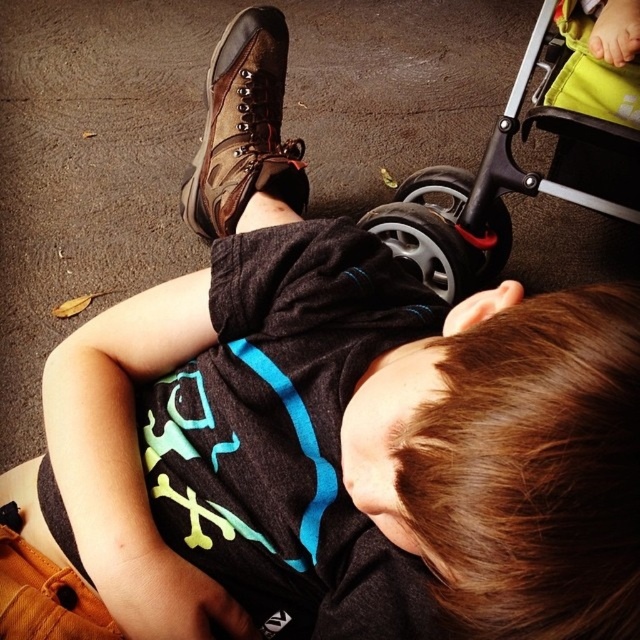
Question: Which object is farther from the camera taking this photo?

Choices:
 (A) brown leather boot at upper center
 (B) black rubber baby carriage at lower right

Answer: (B)

Question: Does black rubber baby carriage at lower right have a greater width compared to brown leather boot at upper center?

Choices:
 (A) yes
 (B) no

Answer: (A)

Question: Among these points, which one is nearest to the camera?

Choices:
 (A) (208, 106)
 (B) (438, 170)

Answer: (A)

Question: Is black rubber baby carriage at lower right to the left of brown leather boot at upper center from the viewer's perspective?

Choices:
 (A) yes
 (B) no

Answer: (B)

Question: Which point appears farthest from the camera in this image?

Choices:
 (A) (196, 209)
 (B) (620, 132)

Answer: (A)

Question: Is black rubber baby carriage at lower right wider than brown leather boot at upper center?

Choices:
 (A) no
 (B) yes

Answer: (B)